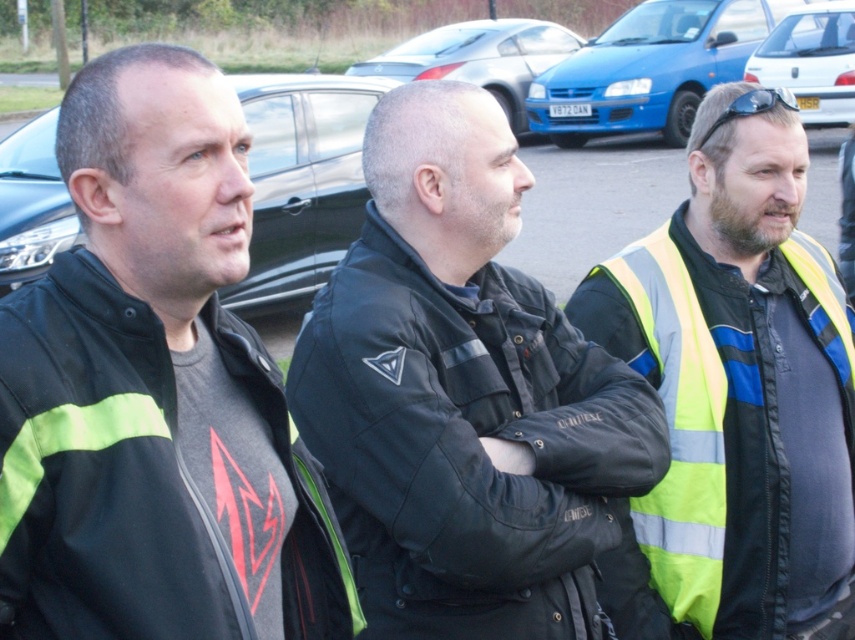
Does metallic silver car at center have a greater height compared to black plastic sunglasses at upper right?

Yes, metallic silver car at center is taller than black plastic sunglasses at upper right.

Between metallic silver car at center and black plastic sunglasses at upper right, which one has less height?

Standing shorter between the two is black plastic sunglasses at upper right.

What do you see at coordinates (479, 58) in the screenshot? The image size is (855, 640). I see `metallic silver car at center` at bounding box center [479, 58].

The width and height of the screenshot is (855, 640). In order to click on metallic silver car at center in this screenshot , I will do `click(479, 58)`.

The width and height of the screenshot is (855, 640). What are the coordinates of `black leather jacket at center` in the screenshot? It's located at (463, 396).

Based on the photo, is the position of black leather jacket at center more distant than that of reflective yellow vest at center?

No, black leather jacket at center is in front of reflective yellow vest at center.

Is point (364, 362) closer to viewer compared to point (705, 396)?

Yes, it is.

Locate an element on the screen. black leather jacket at center is located at coordinates (463, 396).

Does black leather jacket at center have a greater width compared to blue matte hatchback at center?

Incorrect, black leather jacket at center's width does not surpass blue matte hatchback at center's.

Is point (643, 490) in front of point (640, 45)?

Yes, it is in front of point (640, 45).

At what (x,y) coordinates should I click in order to perform the action: click on black leather jacket at center. Please return your answer as a coordinate pair (x, y). This screenshot has width=855, height=640. Looking at the image, I should click on (463, 396).